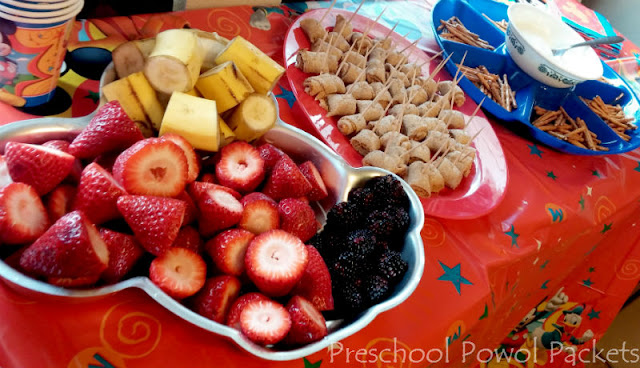
Where is `red plate`? This screenshot has height=368, width=640. red plate is located at coordinates (475, 199).